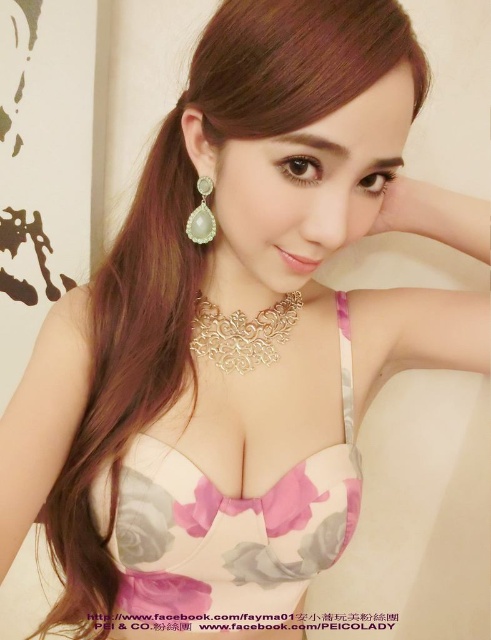
Question: Is pink satin bikini top at center thinner than brown shiny hair at center?

Choices:
 (A) no
 (B) yes

Answer: (B)

Question: Can you confirm if pink satin bikini top at center is positioned to the right of brown shiny hair at center?

Choices:
 (A) yes
 (B) no

Answer: (A)

Question: Where is pink satin bikini top at center located in relation to pearl-like stone earring at left in the image?

Choices:
 (A) right
 (B) left

Answer: (A)

Question: Which of these objects is positioned farthest from the brown shiny hair at center?

Choices:
 (A) gold textured necklace at center
 (B) pink satin bikini top at center

Answer: (A)

Question: Considering the real-world distances, which object is farthest from the gold textured necklace at center?

Choices:
 (A) brown shiny hair at center
 (B) pearl-like stone earring at left
 (C) pink satin bikini top at center

Answer: (A)

Question: Which point appears farthest from the camera in this image?

Choices:
 (A) (229, 344)
 (B) (203, 221)
 (C) (178, 305)
 (D) (342, 448)

Answer: (A)